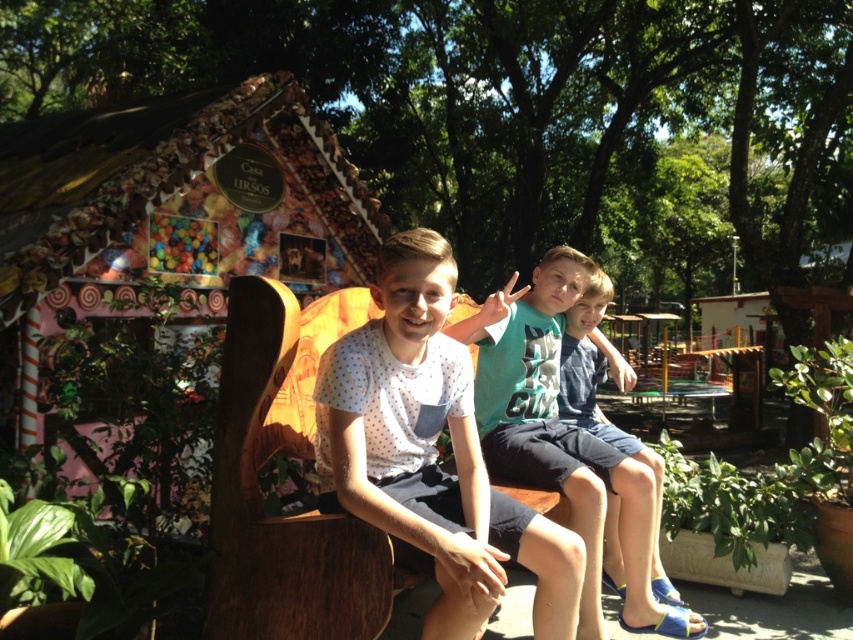
Question: Which point is closer to the camera?

Choices:
 (A) (427, 621)
 (B) (596, 276)

Answer: (A)

Question: Which object is farther from the camera taking this photo?

Choices:
 (A) white dotted shirt at center
 (B) blue denim shorts at center

Answer: (B)

Question: Can you confirm if white dotted shirt at center is smaller than blue denim shorts at center?

Choices:
 (A) yes
 (B) no

Answer: (A)

Question: Which object is closer to the camera taking this photo?

Choices:
 (A) blue denim shorts at center
 (B) white dotted shirt at center

Answer: (B)

Question: Does white dotted shirt at center appear on the left side of blue denim shorts at center?

Choices:
 (A) yes
 (B) no

Answer: (A)

Question: Is white dotted shirt at center further to the viewer compared to blue denim shorts at center?

Choices:
 (A) no
 (B) yes

Answer: (A)